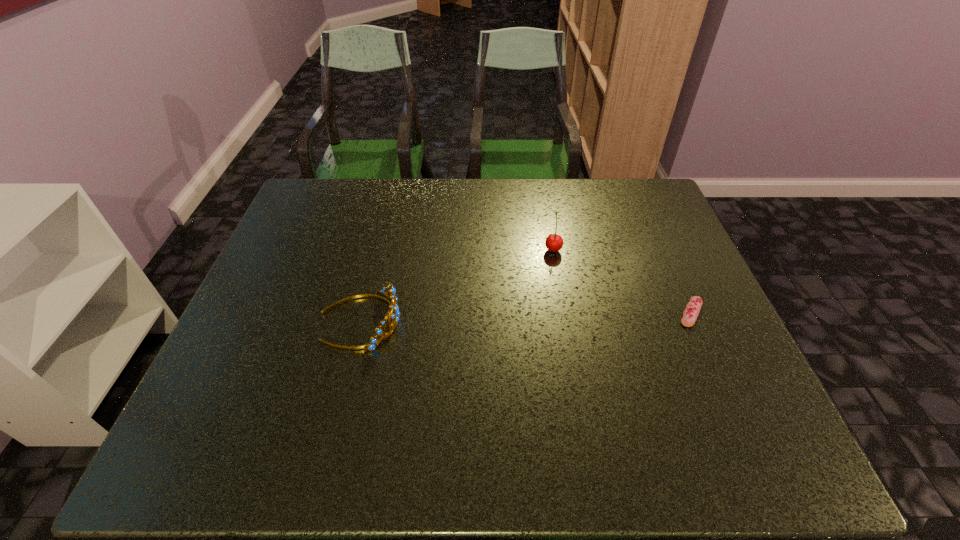
In the image, there is a desktop. At what (x,y) coordinates should I click in order to perform the action: click on free space at the near edge. Please return your answer as a coordinate pair (x, y). Image resolution: width=960 pixels, height=540 pixels. Looking at the image, I should click on (553, 438).

The height and width of the screenshot is (540, 960). Identify the location of free location at the left edge of the desktop. (231, 370).

I want to click on vacant space at the right edge of the desktop, so click(x=689, y=291).

Where is `vacant position at the far left corner of the desktop`? This screenshot has width=960, height=540. vacant position at the far left corner of the desktop is located at coordinates (325, 181).

Where is `free space at the near right corner of the desktop`? The width and height of the screenshot is (960, 540). free space at the near right corner of the desktop is located at coordinates (761, 437).

Locate an element on the screen. The width and height of the screenshot is (960, 540). vacant space in between the farthest object and the tiara is located at coordinates (457, 285).

Locate an element on the screen. This screenshot has height=540, width=960. free space between the second object from right to left and the eclair is located at coordinates (622, 281).

At what (x,y) coordinates should I click in order to perform the action: click on free space between the second object from right to left and the shortest object. Please return your answer as a coordinate pair (x, y). Image resolution: width=960 pixels, height=540 pixels. Looking at the image, I should click on (622, 281).

Where is `free space between the tiara and the cherry`? This screenshot has height=540, width=960. free space between the tiara and the cherry is located at coordinates [457, 285].

Find the location of a particular element. free spot between the tiara and the eclair is located at coordinates (526, 316).